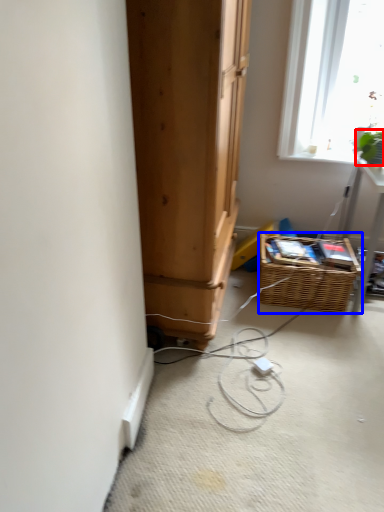
Question: Among these objects, which one is farthest to the camera, plant (highlighted by a red box) or basket (highlighted by a blue box)?

Choices:
 (A) plant
 (B) basket

Answer: (B)